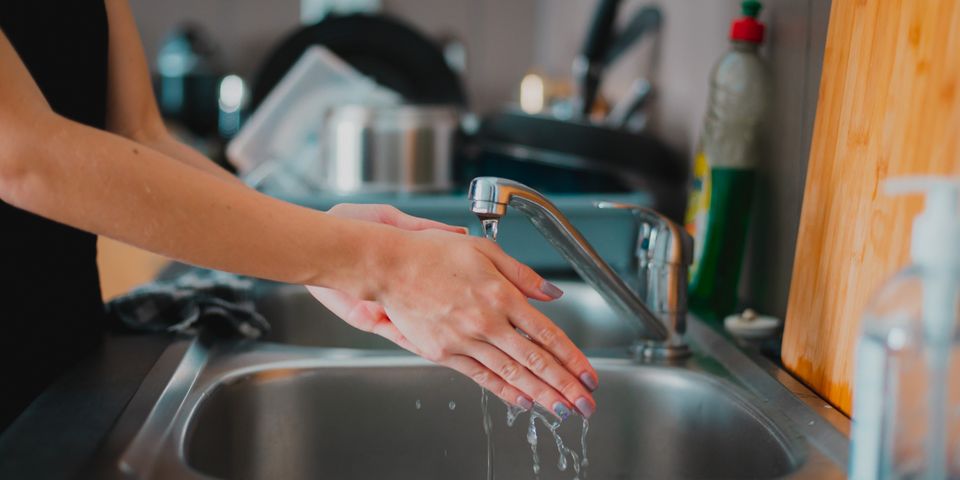
Locate an element on the screen. This screenshot has height=480, width=960. dish soap is located at coordinates (732, 197).